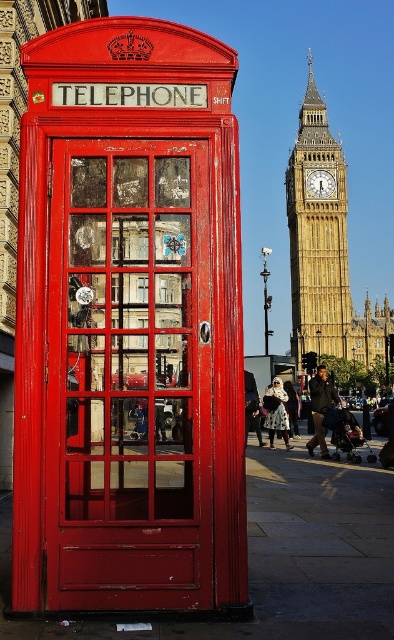
Question: Can you confirm if matte red telephone box at center is positioned to the right of yellow stone clock tower at upper center?

Choices:
 (A) yes
 (B) no

Answer: (B)

Question: Among these points, which one is nearest to the camera?

Choices:
 (A) (221, 179)
 (B) (323, 280)

Answer: (A)

Question: Does matte red telephone box at center have a larger size compared to yellow stone clock tower at upper center?

Choices:
 (A) no
 (B) yes

Answer: (B)

Question: Does matte red telephone box at center have a greater width compared to yellow stone clock tower at upper center?

Choices:
 (A) yes
 (B) no

Answer: (A)